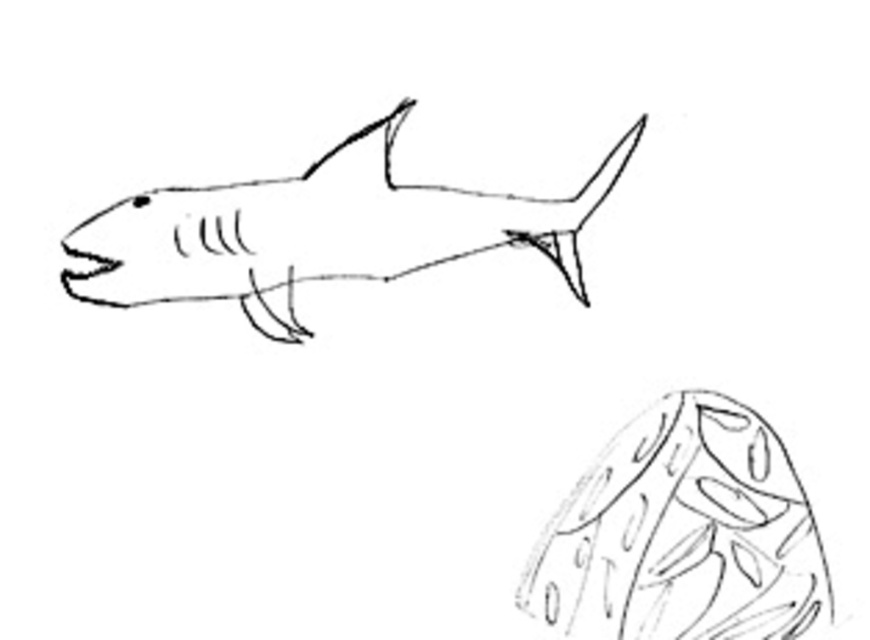
You are an art student who wants to hang both the black line shark at upper center and the smooth gray fish at upper center on your wall. The wall space you have is 12 inches wide. Can both drawings fit side by side without overlapping?

The distance between the black line shark at upper center and the smooth gray fish at upper center is 11.81 inches. Since the wall space is 12 inches wide, both drawings can fit side by side without overlapping as the total required space is slightly less than 12 inches.

You are an art student analyzing the composition of the image. You notice the black line shark at upper center and another creature sketch below it. Based on their positions, which creature is positioned higher in the image?

The black line shark at upper center is positioned higher in the image than the other creature sketch below it.

You are an art student analyzing two drawings in the image. The black line shark at upper center and the smooth gray fish at upper center. Which one do you think is bigger?

The black line shark at upper center is larger than the smooth gray fish at upper center.